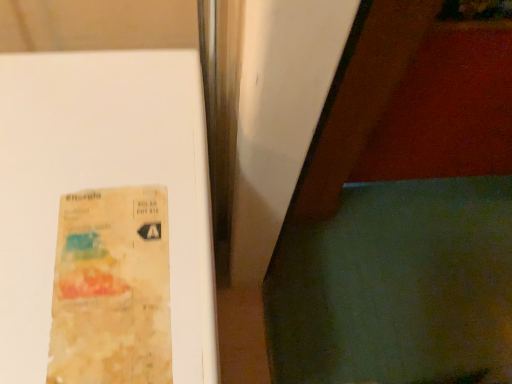
Image resolution: width=512 pixels, height=384 pixels. What do you see at coordinates (101, 186) in the screenshot? I see `yellowish paper book at left` at bounding box center [101, 186].

Locate an element on the screen. yellowish paper book at left is located at coordinates (101, 186).

Where is `yellowish paper book at left`? yellowish paper book at left is located at coordinates (101, 186).